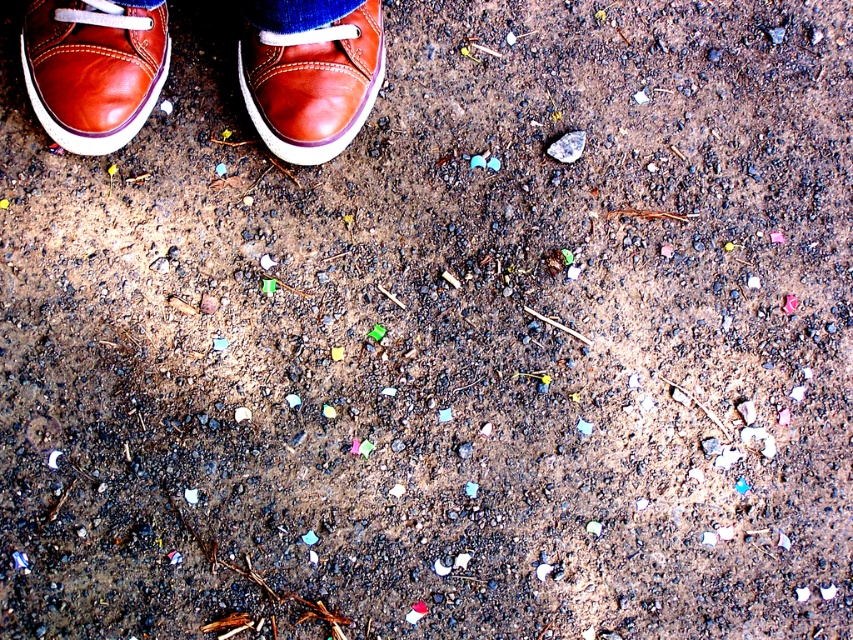
Who is positioned more to the right, matte brown shoe at center or brown leather shoe at upper center?

brown leather shoe at upper center

Find the location of a particular element. The width and height of the screenshot is (853, 640). matte brown shoe at center is located at coordinates (93, 68).

Which is more to the left, matte brown shoe at center or blue denim jeans at upper center?

From the viewer's perspective, matte brown shoe at center appears more on the left side.

Identify the location of matte brown shoe at center. The width and height of the screenshot is (853, 640). (93, 68).

This screenshot has height=640, width=853. I want to click on matte brown shoe at center, so click(93, 68).

Does brown leather shoe at upper center have a larger size compared to blue denim jeans at upper center?

Yes, brown leather shoe at upper center is bigger than blue denim jeans at upper center.

Looking at this image, is brown leather shoe at upper center below blue denim jeans at upper center?

Indeed, brown leather shoe at upper center is positioned under blue denim jeans at upper center.

Locate an element on the screen. The width and height of the screenshot is (853, 640). brown leather shoe at upper center is located at coordinates 312,81.